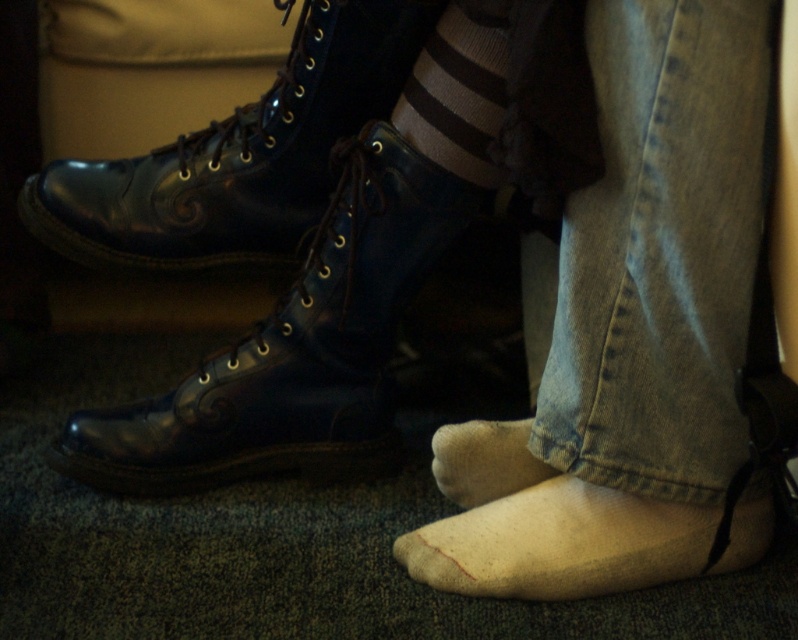
From the picture: Based on the scene description, where is the denim at right located in the image?

The denim at right is located at point (658, 252).

You are standing in a room and see two feet in front of you. One has black leather boots with laces, and the other has striped wool socks. There is a point marked at coordinates (457, 92). Which object is located at that point?

The point at (457, 92) indicates the striped wool sock at center.